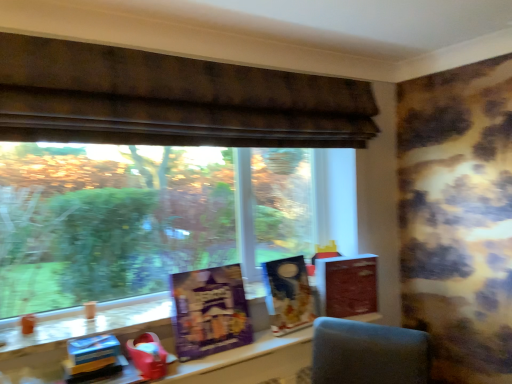
Where is `vacant region above blue cardboard box at lower left, which ranks as the 2th toy in right-to-left order (from a real-world perspective)`? This screenshot has width=512, height=384. vacant region above blue cardboard box at lower left, which ranks as the 2th toy in right-to-left order (from a real-world perspective) is located at coordinates (93, 364).